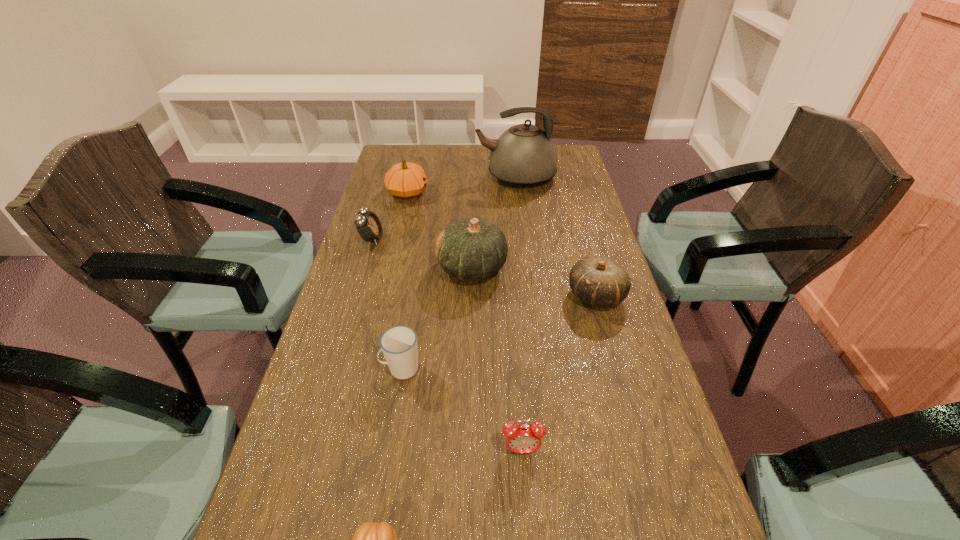
This screenshot has width=960, height=540. Identify the location of vacant space located at the spout of the kettle. (440, 177).

The image size is (960, 540). Find the location of `blank space located on the back of the tallest gourd`. blank space located on the back of the tallest gourd is located at coordinates (472, 226).

Identify the location of free spot located 0.380m on the side of the farthest gourd with the carved face. Image resolution: width=960 pixels, height=540 pixels. (540, 192).

At what (x,y) coordinates should I click in order to perform the action: click on vacant area situated 0.080m on the back of the rightmost gourd. Please return your answer as a coordinate pair (x, y). This screenshot has height=540, width=960. Looking at the image, I should click on (586, 258).

You are a GUI agent. You are given a task and a screenshot of the screen. Output one action in this format:
    pyautogui.click(x=<x>, y=<y>)
    Task: Click on the vacant space located on the face of the left alarm clock
    This screenshot has height=540, width=960.
    Given the screenshot: What is the action you would take?
    pyautogui.click(x=430, y=239)

Find the location of a particular element. The width and height of the screenshot is (960, 540). vacant region located 0.100m on the face of the right alarm clock is located at coordinates (527, 515).

This screenshot has width=960, height=540. What are the coordinates of `object present at the far edge` in the screenshot? It's located at (524, 156).

Identify the location of gourd that is at the left edge. The image size is (960, 540). click(406, 180).

At what (x,y) coordinates should I click in order to perform the action: click on alarm clock at the left edge. Please return your answer as a coordinate pair (x, y). The image size is (960, 540). Looking at the image, I should click on (369, 227).

This screenshot has width=960, height=540. Find the location of `cup present at the left edge`. cup present at the left edge is located at coordinates (399, 343).